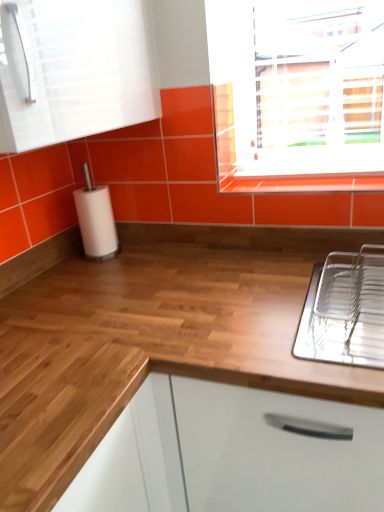
Question: Considering the relative sizes of white matte paper towel at left and clear plastic dish rack at right in the image provided, is white matte paper towel at left taller than clear plastic dish rack at right?

Choices:
 (A) no
 (B) yes

Answer: (B)

Question: From a real-world perspective, is white matte paper towel at left on top of clear plastic dish rack at right?

Choices:
 (A) no
 (B) yes

Answer: (B)

Question: Does white matte paper towel at left come behind clear plastic dish rack at right?

Choices:
 (A) no
 (B) yes

Answer: (B)

Question: Is the position of white matte paper towel at left less distant than that of clear plastic dish rack at right?

Choices:
 (A) yes
 (B) no

Answer: (B)

Question: Is white matte paper towel at left facing away from clear plastic dish rack at right?

Choices:
 (A) no
 (B) yes

Answer: (A)

Question: In terms of size, does glossy orange tile at upper center appear bigger or smaller than clear plastic dish rack at right?

Choices:
 (A) small
 (B) big

Answer: (A)

Question: Considering their positions, is glossy orange tile at upper center located in front of or behind clear plastic dish rack at right?

Choices:
 (A) front
 (B) behind

Answer: (B)

Question: Looking at their shapes, would you say glossy orange tile at upper center is wider or thinner than clear plastic dish rack at right?

Choices:
 (A) wide
 (B) thin

Answer: (B)

Question: From the image's perspective, is glossy orange tile at upper center positioned above or below clear plastic dish rack at right?

Choices:
 (A) below
 (B) above

Answer: (B)

Question: In the image, is glossy orange tile at upper center on the left side or the right side of wooden at center?

Choices:
 (A) right
 (B) left

Answer: (A)

Question: Is glossy orange tile at upper center in front of or behind wooden at center in the image?

Choices:
 (A) behind
 (B) front

Answer: (A)

Question: From their relative heights in the image, would you say glossy orange tile at upper center is taller or shorter than wooden at center?

Choices:
 (A) short
 (B) tall

Answer: (A)

Question: From a real-world perspective, is glossy orange tile at upper center positioned above or below wooden at center?

Choices:
 (A) above
 (B) below

Answer: (A)

Question: Relative to wooden at center, is white glossy cabinet at upper left in front or behind?

Choices:
 (A) behind
 (B) front

Answer: (B)

Question: Is white glossy cabinet at upper left bigger or smaller than wooden at center?

Choices:
 (A) big
 (B) small

Answer: (B)